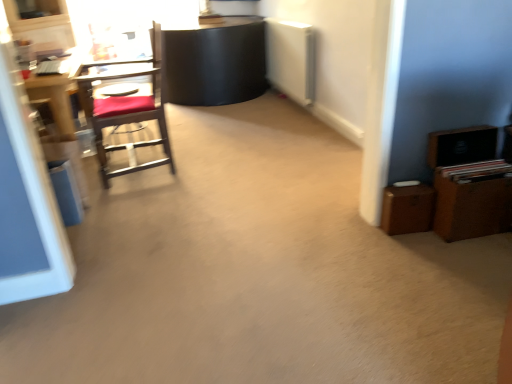
Question: Does wooden desk at left have a larger size compared to brown wooden dresser at right?

Choices:
 (A) yes
 (B) no

Answer: (A)

Question: Is wooden desk at left positioned in front of brown wooden dresser at right?

Choices:
 (A) yes
 (B) no

Answer: (B)

Question: Considering the relative positions of wooden desk at left and brown wooden dresser at right in the image provided, is wooden desk at left behind brown wooden dresser at right?

Choices:
 (A) no
 (B) yes

Answer: (B)

Question: Does wooden desk at left appear on the right side of brown wooden dresser at right?

Choices:
 (A) no
 (B) yes

Answer: (A)

Question: Are wooden desk at left and brown wooden dresser at right beside each other?

Choices:
 (A) no
 (B) yes

Answer: (A)

Question: Is brown wooden dresser at right inside wooden desk at left?

Choices:
 (A) no
 (B) yes

Answer: (A)

Question: Is wooden chair with red cushion at left positioned with its back to wooden desk at left?

Choices:
 (A) no
 (B) yes

Answer: (A)

Question: From the image's perspective, is wooden chair with red cushion at left on wooden desk at left?

Choices:
 (A) yes
 (B) no

Answer: (B)

Question: Is wooden chair with red cushion at left smaller than wooden desk at left?

Choices:
 (A) yes
 (B) no

Answer: (B)

Question: Does wooden chair with red cushion at left have a larger size compared to wooden desk at left?

Choices:
 (A) yes
 (B) no

Answer: (A)

Question: From a real-world perspective, does wooden chair with red cushion at left sit lower than wooden desk at left?

Choices:
 (A) no
 (B) yes

Answer: (A)

Question: Considering the relative positions of wooden chair with red cushion at left and wooden desk at left in the image provided, is wooden chair with red cushion at left to the right of wooden desk at left from the viewer's perspective?

Choices:
 (A) no
 (B) yes

Answer: (B)

Question: Is brown wooden dresser at right at the right side of wooden desk at left?

Choices:
 (A) yes
 (B) no

Answer: (A)